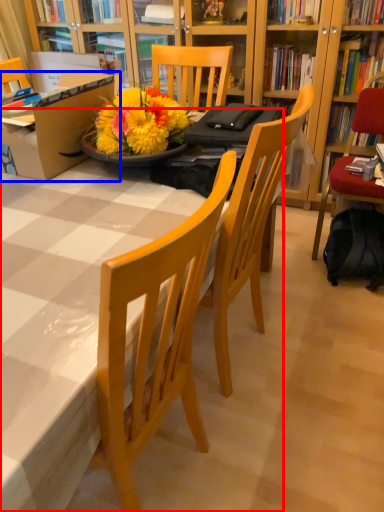
Question: Among these objects, which one is farthest to the camera, desk (highlighted by a red box) or box (highlighted by a blue box)?

Choices:
 (A) desk
 (B) box

Answer: (B)